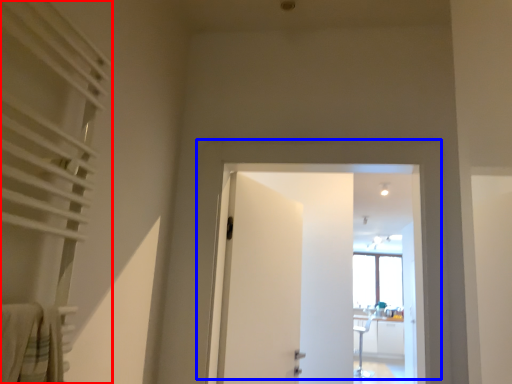
Question: Which object appears closest to the camera in this image, curtain (highlighted by a red box) or door (highlighted by a blue box)?

Choices:
 (A) curtain
 (B) door

Answer: (A)